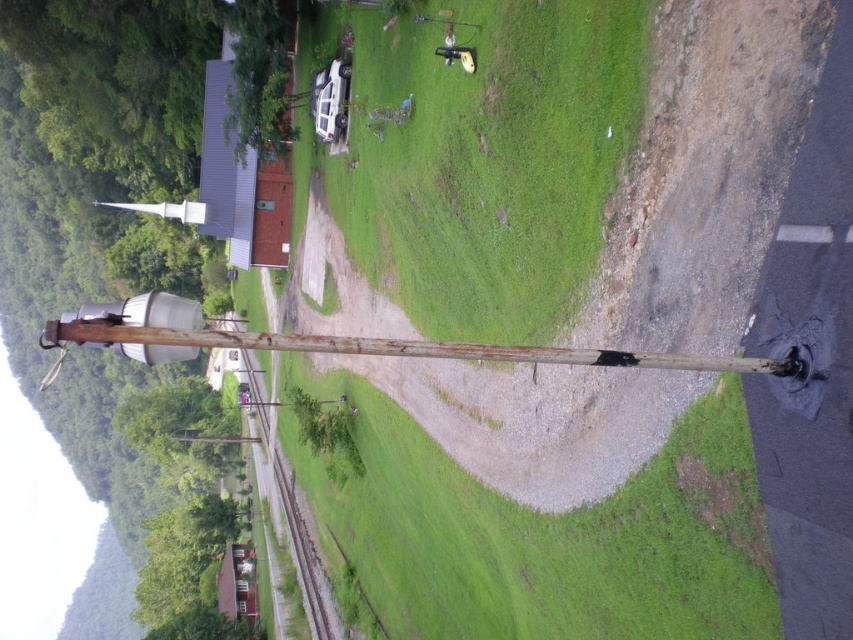
You are standing in the rural area and see the green grassy at center and the rusty wood pole at left. Which object is located higher up in the image?

The green grassy at center is positioned over the rusty wood pole at left, so it is higher up in the image.

You are standing at the entrance of the rural area and see the green grassy at center and the rusty wood pole at left. Which one is closer to your right side?

The green grassy at center is positioned on the right side of rusty wood pole at left, so the green grassy at center is closer to your right side.

You are standing at the point closest to the utility pole in this rural scene. There are two points marked in the image, one at coordinates point (x=466, y=253) and another at point (x=512, y=362). Which of these points is farther away from you?

Point (x=466, y=253) is behind point (x=512, y=362), so the point farther away from you is point (x=466, y=253).